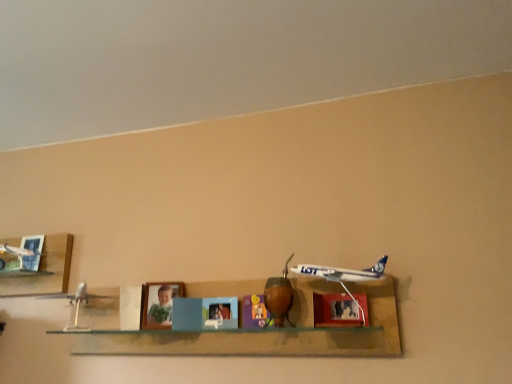
Question: Considering the positions of white glossy airplane at center, which is the second shelf in left-to-right order, and matte wooden picture frame at center, which is the first picture frame in front-to-back order, in the image, is white glossy airplane at center, which is the second shelf in left-to-right order, taller or shorter than matte wooden picture frame at center, which is the first picture frame in front-to-back order,?

Choices:
 (A) short
 (B) tall

Answer: (B)

Question: In terms of size, does white glossy airplane at center, the 1th shelf viewed from the right, appear bigger or smaller than matte wooden picture frame at center, which is the first picture frame in front-to-back order?

Choices:
 (A) big
 (B) small

Answer: (A)

Question: Estimate the real-world distances between objects in this image. Which object is closer to the matte wooden picture frame at center, the 2th picture frame viewed from the back?

Choices:
 (A) brushed metal airplane at left, which is the second shelf in right-to-left order
 (B) matte plastic toy at center, the 1th toy from the back
 (C) white glossy airplane at center, which is the second shelf in left-to-right order
 (D) brushed metal picture frame at upper left, the 1th picture frame when ordered from back to front
 (E) brown wooden gourd at center, the 1th toy positioned from the front

Answer: (E)

Question: Considering the real-world distances, which object is closest to the matte wooden picture frame at center, which ranks as the 2th picture frame in left-to-right order?

Choices:
 (A) brown wooden gourd at center, the 1th toy positioned from the front
 (B) matte plastic toy at center, which ranks as the second toy in front-to-back order
 (C) brushed metal picture frame at upper left, which is counted as the 1th picture frame, starting from the left
 (D) metallic blue airplane at center
 (E) brushed metal airplane at left, which is the second shelf in right-to-left order

Answer: (D)